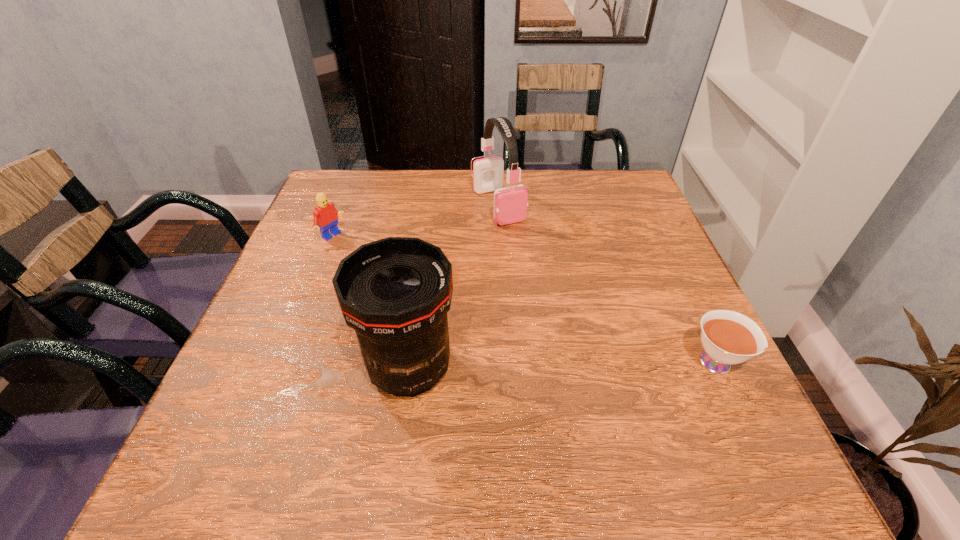
Locate an element on the screen. The height and width of the screenshot is (540, 960). vacant space located on the front-facing side of the leftmost object is located at coordinates (440, 305).

Where is `blank space located 0.090m on the outer surface of the farthest object`? This screenshot has width=960, height=540. blank space located 0.090m on the outer surface of the farthest object is located at coordinates (524, 248).

This screenshot has height=540, width=960. In order to click on vacant area situated 0.080m on the outer surface of the farthest object in this screenshot , I will do `click(522, 245)`.

What are the coordinates of `vacant position located on the outer surface of the farthest object` in the screenshot? It's located at (556, 294).

Image resolution: width=960 pixels, height=540 pixels. In order to click on object located at the far edge in this screenshot , I will do `click(510, 203)`.

Locate an element on the screen. This screenshot has height=540, width=960. telephoto lens located at the near edge is located at coordinates (395, 293).

What are the coordinates of `teacup that is at the near edge` in the screenshot? It's located at (728, 337).

Identify the location of object at the left edge. This screenshot has height=540, width=960. (325, 215).

In order to click on object positioned at the right edge in this screenshot , I will do `click(728, 337)`.

At what (x,y) coordinates should I click in order to perform the action: click on object located at the near right corner. Please return your answer as a coordinate pair (x, y). The width and height of the screenshot is (960, 540). Looking at the image, I should click on (728, 337).